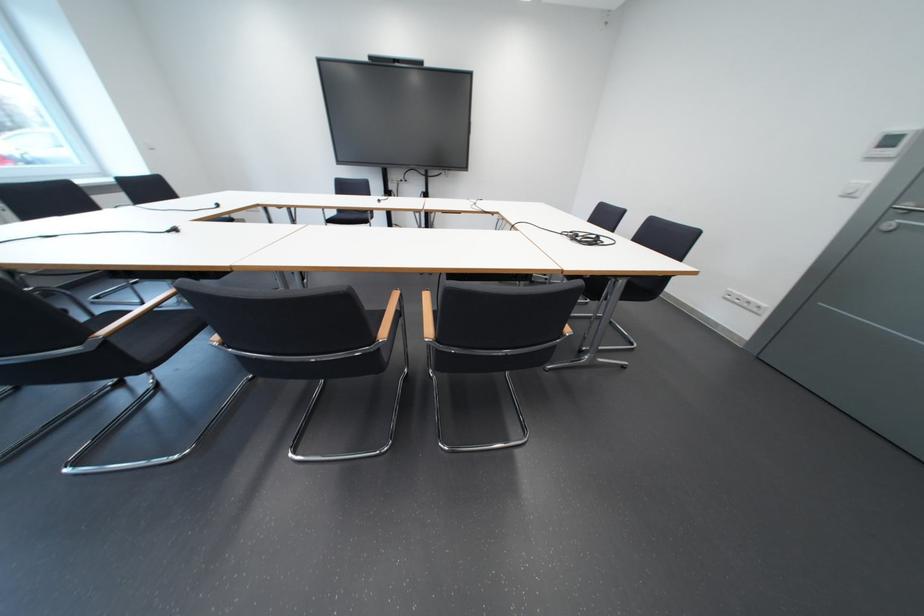
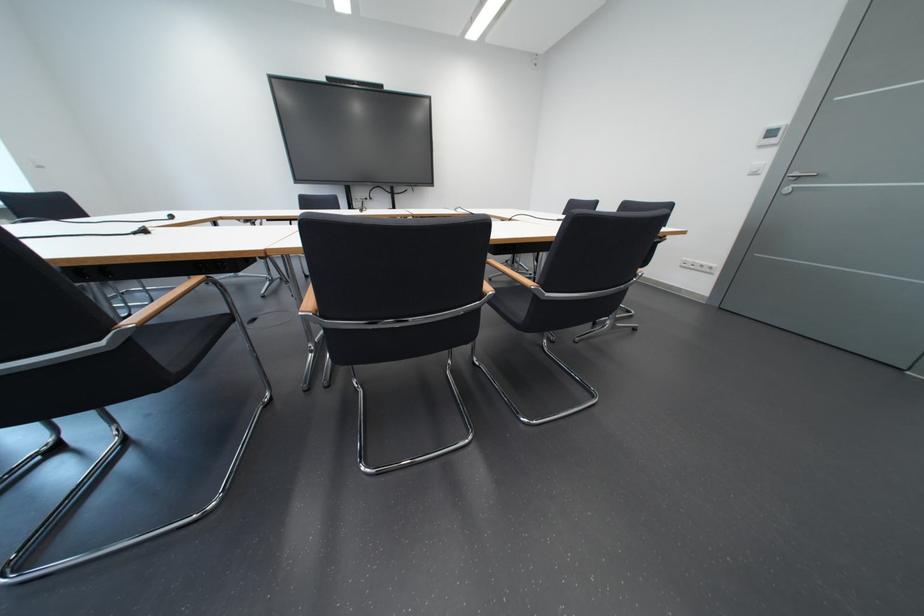
Question: The images are taken continuously from a first-person perspective. In which direction are you moving?

Choices:
 (A) Left
 (B) Right
 (C) Forward
 (D) Backward

Answer: (A)